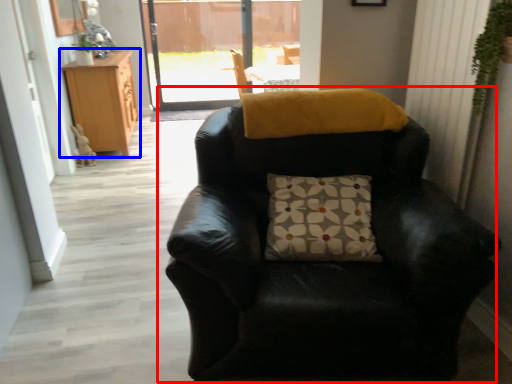
Question: Which object is closer to the camera taking this photo, chair (highlighted by a red box) or cabinetry (highlighted by a blue box)?

Choices:
 (A) chair
 (B) cabinetry

Answer: (A)